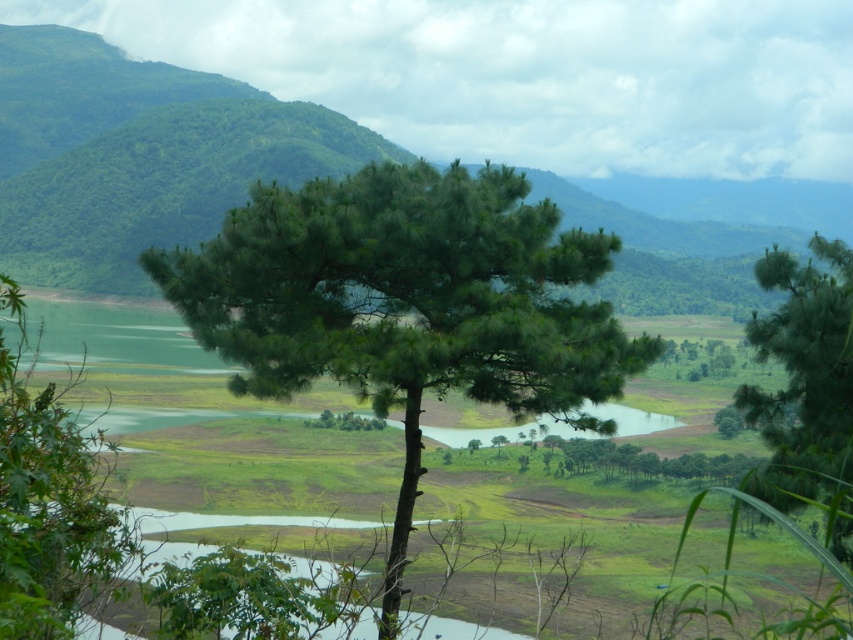
Question: Does green matte tree at center have a smaller size compared to green matte tree at right?

Choices:
 (A) yes
 (B) no

Answer: (B)

Question: Is green leafy mountain at center further to camera compared to green matte tree at lower left?

Choices:
 (A) no
 (B) yes

Answer: (B)

Question: Which object is the farthest from the green matte tree at center?

Choices:
 (A) green matte tree at right
 (B) green leafy mountain at center

Answer: (B)

Question: Is green matte tree at center closer to the viewer compared to green leafy mountain at center?

Choices:
 (A) no
 (B) yes

Answer: (B)

Question: Among these objects, which one is farthest from the camera?

Choices:
 (A) green leafy mountain at center
 (B) green matte tree at right

Answer: (A)

Question: Which object is positioned farthest from the green leafy mountain at center?

Choices:
 (A) green matte tree at right
 (B) green matte tree at lower left
 (C) green matte tree at center

Answer: (A)